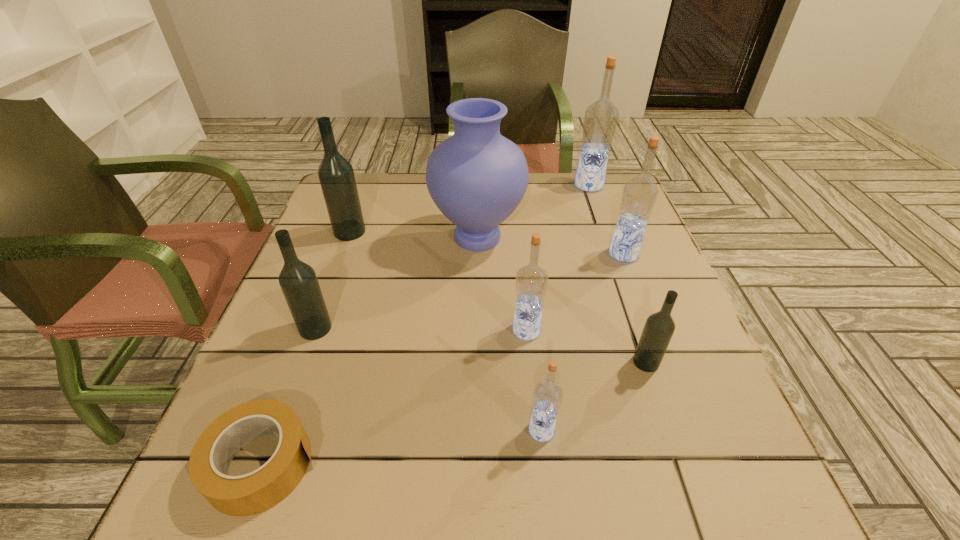
At what (x,y) coordinates should I click in order to perform the action: click on free region at the near edge of the desktop. Please return your answer as a coordinate pair (x, y). The image size is (960, 540). Looking at the image, I should click on click(x=605, y=516).

This screenshot has width=960, height=540. In the image, there is a desktop. In order to click on vacant area at the left edge in this screenshot , I will do `click(336, 275)`.

Where is `free spot at the right edge of the desktop`? The image size is (960, 540). free spot at the right edge of the desktop is located at coordinates (605, 288).

I want to click on free space at the far left corner, so click(x=388, y=185).

The height and width of the screenshot is (540, 960). What are the coordinates of `free location at the far right corner` in the screenshot? It's located at (600, 211).

At what (x,y) coordinates should I click in order to perform the action: click on free point between the blue vase and the farthest object. Please return your answer as a coordinate pair (x, y). This screenshot has height=540, width=960. Looking at the image, I should click on (533, 211).

Locate an element on the screen. The width and height of the screenshot is (960, 540). free area in between the second smallest black vodka and the vase is located at coordinates (396, 282).

This screenshot has height=540, width=960. In order to click on free space between the shortest object and the second farthest blue vodka in this screenshot , I will do `click(444, 359)`.

Identify the location of free spot between the farthest black vodka and the shortest object. (306, 348).

The width and height of the screenshot is (960, 540). Find the location of `free point between the smallest black vodka and the biggest blue vodka`. free point between the smallest black vodka and the biggest blue vodka is located at coordinates (617, 274).